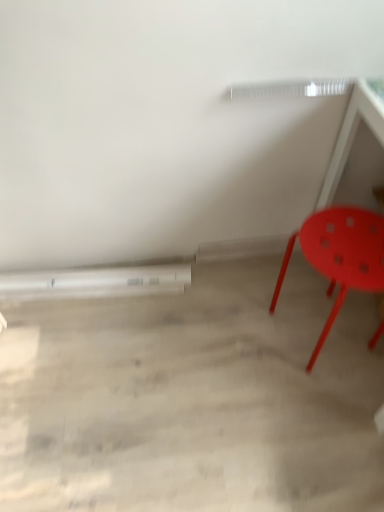
What do you see at coordinates (340, 255) in the screenshot?
I see `matte plastic chair at right` at bounding box center [340, 255].

At what (x,y) coordinates should I click in order to perform the action: click on matte plastic chair at right. Please return your answer as a coordinate pair (x, y). The image size is (384, 512). Looking at the image, I should click on click(x=340, y=255).

The height and width of the screenshot is (512, 384). I want to click on matte plastic chair at right, so click(x=340, y=255).